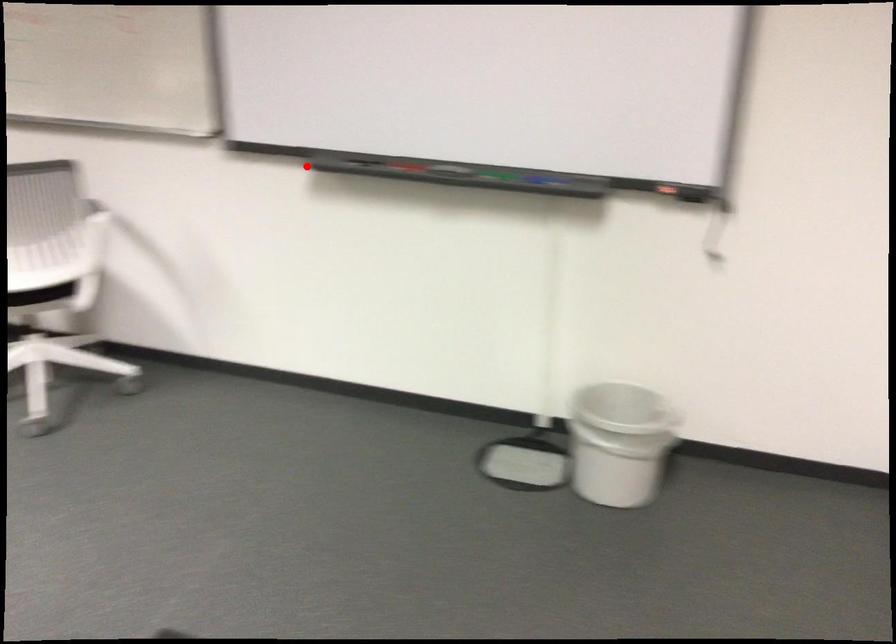
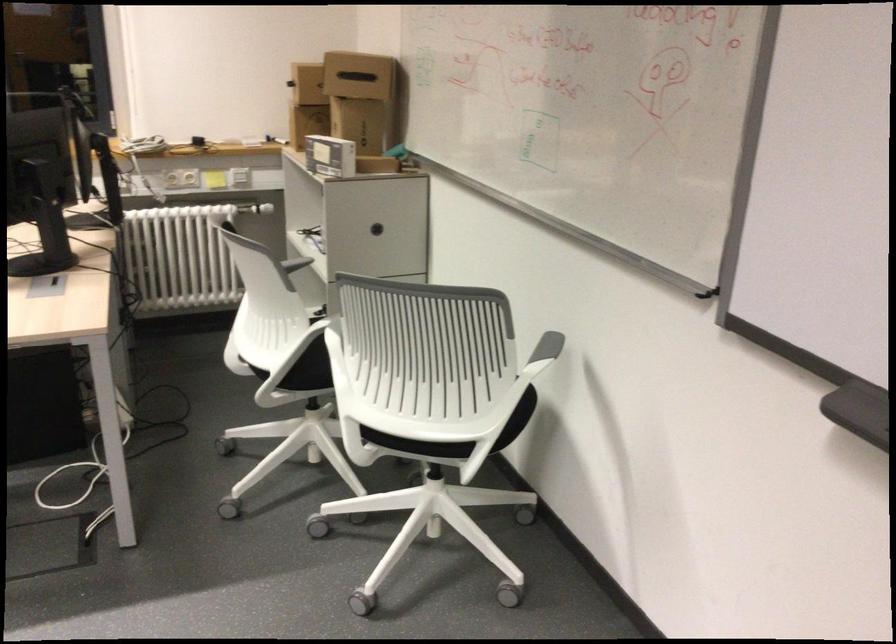
Locate, in the second image, the point that corresponds to the highlighted location in the first image.

(858, 411)